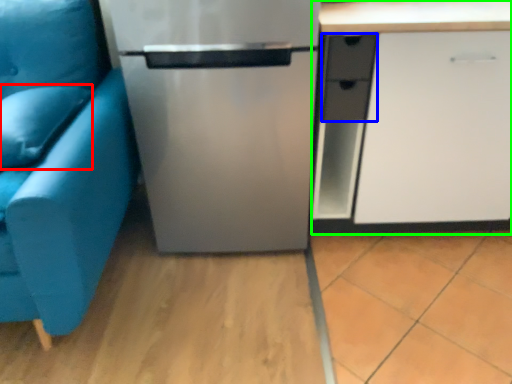
Question: Which object is the farthest from pillow (highlighted by a red box)? Choose among these: drawer (highlighted by a blue box) or cabinetry (highlighted by a green box).

Choices:
 (A) drawer
 (B) cabinetry

Answer: (B)